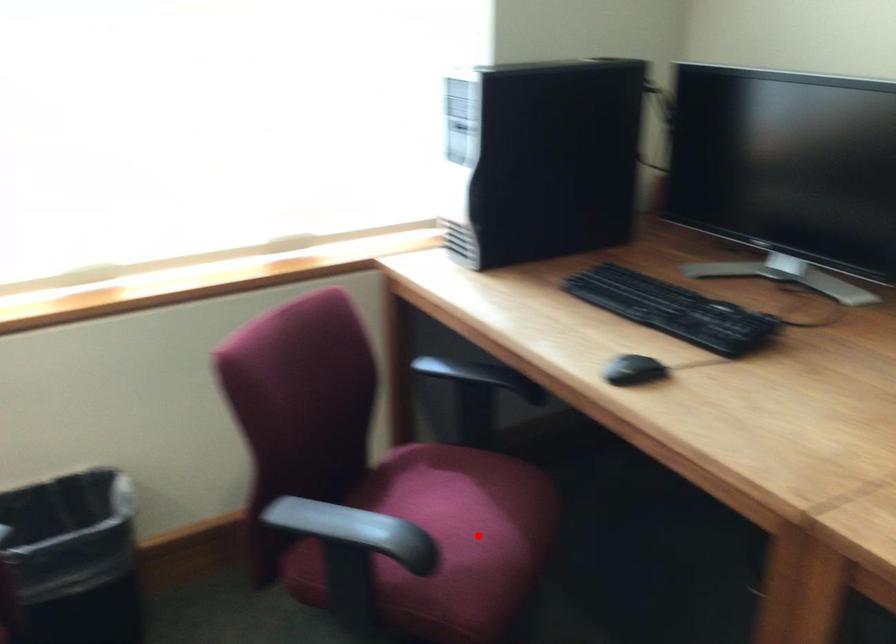
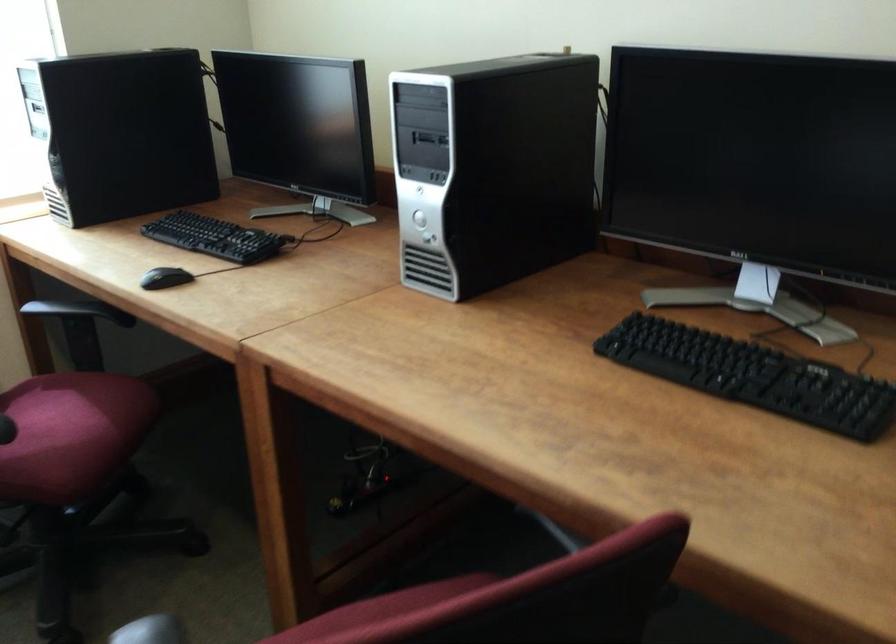
Question: I am providing you with two images of the same scene from different viewpoints. Image1 has a red point marked. In image2, the corresponding 3D location appears at what relative position? Reply with the corresponding letter.

Choices:
 (A) Closer
 (B) Farther

Answer: (B)